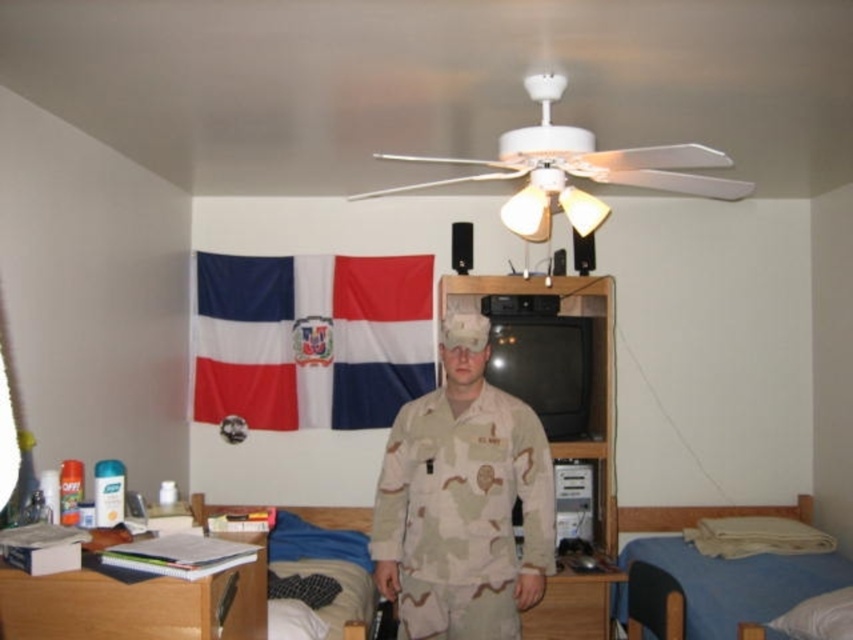
You are standing in the dormitory room and want to locate the blue fabric bed at lower right. According to the coordinates provided, where should you look?

The blue fabric bed at lower right is located at point [701,515].